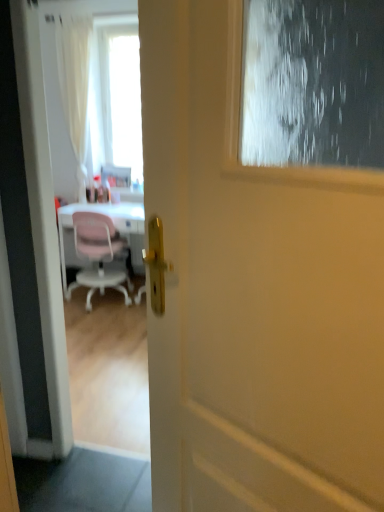
Question: Is pink plastic chair at left further to camera compared to transparent glass screen door at upper center?

Choices:
 (A) no
 (B) yes

Answer: (B)

Question: Are pink plastic chair at left and transparent glass screen door at upper center located far from each other?

Choices:
 (A) no
 (B) yes

Answer: (B)

Question: Does pink plastic chair at left lie in front of transparent glass screen door at upper center?

Choices:
 (A) no
 (B) yes

Answer: (A)

Question: Does pink plastic chair at left appear on the right side of transparent glass screen door at upper center?

Choices:
 (A) yes
 (B) no

Answer: (B)

Question: Does pink plastic chair at left have a greater height compared to transparent glass screen door at upper center?

Choices:
 (A) yes
 (B) no

Answer: (B)

Question: In the image, is transparent glass screen door at upper center on the left side or the right side of pink plastic chair at left?

Choices:
 (A) right
 (B) left

Answer: (A)

Question: In the image, is transparent glass screen door at upper center positioned in front of or behind pink plastic chair at left?

Choices:
 (A) behind
 (B) front

Answer: (B)

Question: Is transparent glass screen door at upper center situated inside pink plastic chair at left or outside?

Choices:
 (A) outside
 (B) inside

Answer: (A)

Question: From the image's perspective, relative to pink plastic chair at left, is transparent glass screen door at upper center above or below?

Choices:
 (A) below
 (B) above

Answer: (A)

Question: From a real-world perspective, is pink plastic chair at left above or below transparent glass screen door at upper center?

Choices:
 (A) below
 (B) above

Answer: (A)

Question: Looking at the image, does pink plastic chair at left seem bigger or smaller compared to transparent glass screen door at upper center?

Choices:
 (A) big
 (B) small

Answer: (A)

Question: Is pink plastic chair at left inside the boundaries of transparent glass screen door at upper center, or outside?

Choices:
 (A) outside
 (B) inside

Answer: (A)

Question: From the image's perspective, is pink plastic chair at left positioned above or below transparent glass screen door at upper center?

Choices:
 (A) below
 (B) above

Answer: (B)

Question: Relative to white matte door at center, is transparent glass screen door at upper center in front or behind?

Choices:
 (A) behind
 (B) front

Answer: (A)

Question: Based on their sizes in the image, would you say transparent glass screen door at upper center is bigger or smaller than white matte door at center?

Choices:
 (A) big
 (B) small

Answer: (A)